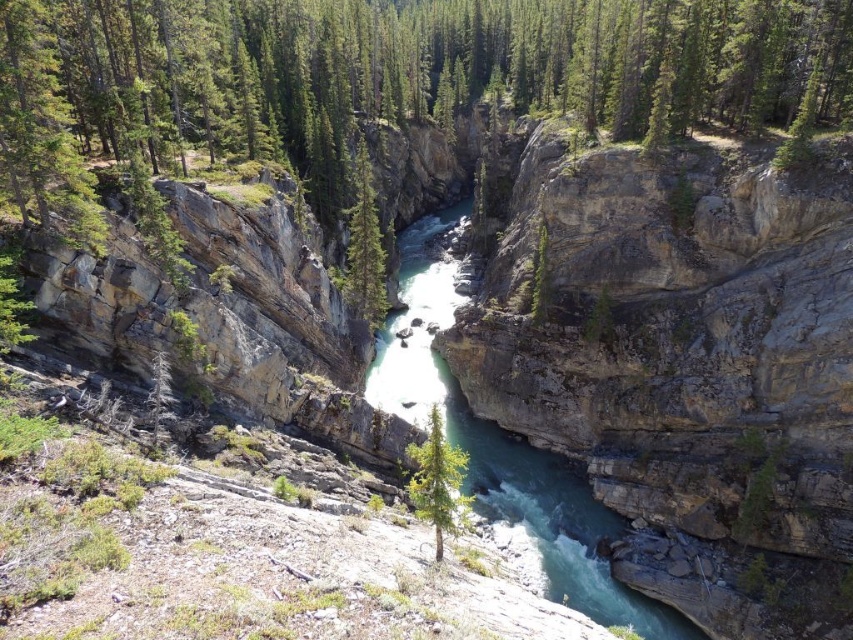
Who is taller, turquoise smooth river at center or green matte tree at center?

Standing taller between the two is turquoise smooth river at center.

Describe the element at coordinates (503, 451) in the screenshot. Image resolution: width=853 pixels, height=640 pixels. I see `turquoise smooth river at center` at that location.

Between point (451, 268) and point (456, 464), which one is positioned in front?

Point (456, 464) is more forward.

At what (x,y) coordinates should I click in order to perform the action: click on turquoise smooth river at center. Please return your answer as a coordinate pair (x, y). Looking at the image, I should click on (503, 451).

Who is taller, turquoise smooth river at center or green textured tree at center?

turquoise smooth river at center is taller.

Does turquoise smooth river at center have a greater width compared to green textured tree at center?

Yes, turquoise smooth river at center is wider than green textured tree at center.

Between point (556, 557) and point (375, 324), which one is positioned in front?

Point (556, 557) is more forward.

The height and width of the screenshot is (640, 853). What are the coordinates of `turquoise smooth river at center` in the screenshot? It's located at (503, 451).

Is point (440, 500) positioned in front of point (364, 180)?

Yes.

Who is higher up, green matte tree at center or green textured tree at center?

green textured tree at center is above.

The image size is (853, 640). What do you see at coordinates (437, 481) in the screenshot?
I see `green matte tree at center` at bounding box center [437, 481].

Find the location of `green matte tree at center`. green matte tree at center is located at coordinates (437, 481).